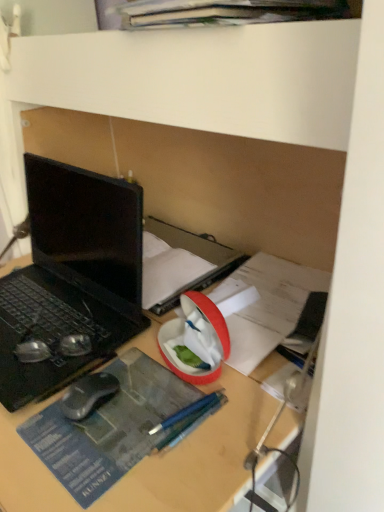
At what (x,y) coordinates should I click in order to perform the action: click on vacant region above matte black book at center (from a real-world perspective). Please return your answer as a coordinate pair (x, y). The height and width of the screenshot is (512, 384). Looking at the image, I should click on (172, 252).